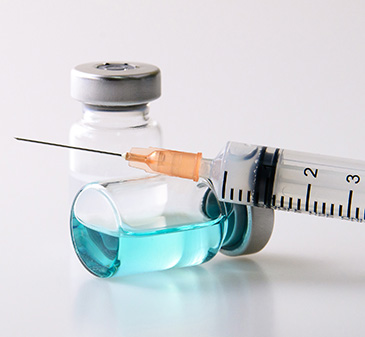
This screenshot has height=337, width=365. In order to click on empty bottle in this screenshot , I will do `click(110, 136)`.